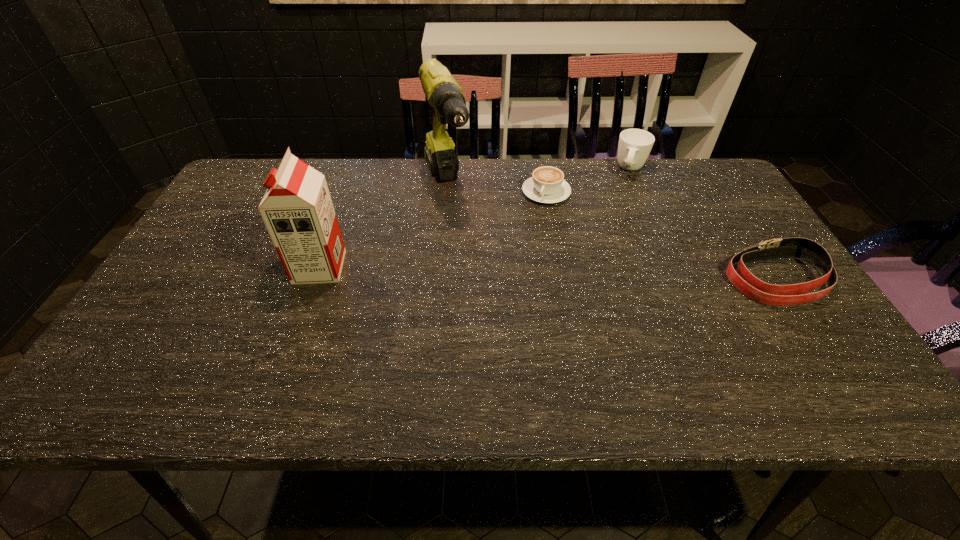
Where is `drill that is at the far edge`? The width and height of the screenshot is (960, 540). drill that is at the far edge is located at coordinates point(444,94).

Where is `cup that is at the far edge`? cup that is at the far edge is located at coordinates (634, 147).

Identify the location of object positioned at the right edge. This screenshot has width=960, height=540. (743, 280).

Find the location of a particular element. The height and width of the screenshot is (540, 960). free spot at the far edge of the desktop is located at coordinates (389, 172).

Locate an element on the screen. free point at the near edge is located at coordinates (313, 356).

In the image, there is a desktop. Where is `free space at the left edge`? free space at the left edge is located at coordinates (182, 284).

In the image, there is a desktop. Identify the location of vacant space at the right edge. The image size is (960, 540). (788, 269).

Where is `vacant space at the far right corner of the desktop`? vacant space at the far right corner of the desktop is located at coordinates (727, 200).

Where is `empty space between the rightmost object and the cappuccino`? empty space between the rightmost object and the cappuccino is located at coordinates (661, 236).

Locate an element on the screen. free space between the cup and the cappuccino is located at coordinates (588, 181).